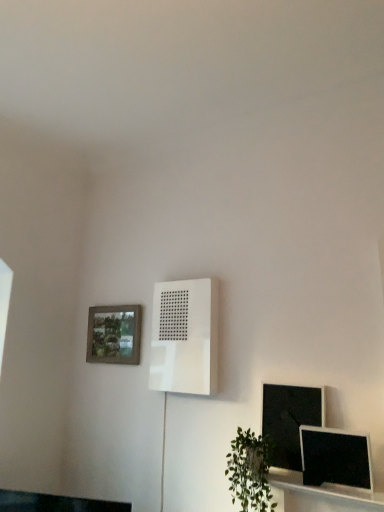
Question: Considering their positions, is white matte air conditioner at center located in front of or behind green leafy plant at lower right?

Choices:
 (A) front
 (B) behind

Answer: (B)

Question: Is white matte air conditioner at center inside or outside of green leafy plant at lower right?

Choices:
 (A) outside
 (B) inside

Answer: (A)

Question: Based on their relative distances, which object is nearer to the green leafy plant at lower right?

Choices:
 (A) white matte air conditioner at center
 (B) matte black monitor at lower right, marked as the second computer monitor in a back-to-front arrangement
 (C) matte black monitor at lower right, arranged as the 1th computer monitor when viewed from the back
 (D) wooden textured picture frame at upper left

Answer: (C)

Question: Which of these objects is positioned farthest from the green leafy plant at lower right?

Choices:
 (A) matte black monitor at lower right, marked as the first computer monitor in a front-to-back arrangement
 (B) white matte air conditioner at center
 (C) matte black monitor at lower right, arranged as the 1th computer monitor when viewed from the back
 (D) wooden textured picture frame at upper left

Answer: (D)